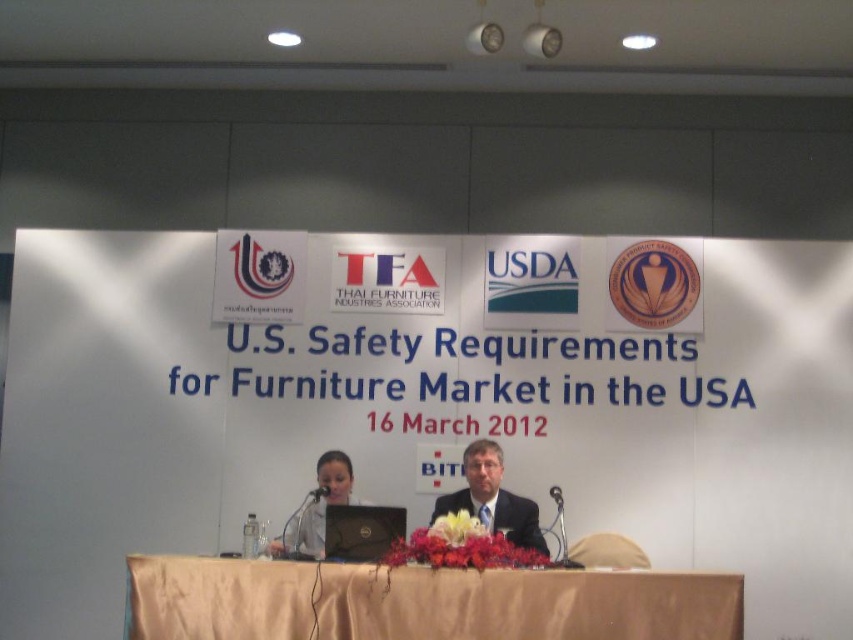
Who is shorter, gold satin table at center or dark suit at center?

Standing shorter between the two is gold satin table at center.

Which is behind, point (596, 572) or point (496, 452)?

The point (496, 452) is more distant.

Locate an element on the screen. This screenshot has width=853, height=640. gold satin table at center is located at coordinates (421, 602).

I want to click on gold satin table at center, so click(x=421, y=602).

From the picture: Who is positioned more to the right, dark suit at center or black matte laptop at center?

dark suit at center is more to the right.

Is dark suit at center below black matte laptop at center?

Yes.

Who is more forward, (544, 548) or (363, 545)?

Point (363, 545)

Identify the location of dark suit at center. (492, 499).

Is gold satin table at center above black matte laptop at center?

No.

In the scene shown: Does gold satin table at center have a lesser width compared to black matte laptop at center?

Incorrect, gold satin table at center's width is not less than black matte laptop at center's.

Find the location of a particular element. Image resolution: width=853 pixels, height=640 pixels. gold satin table at center is located at coordinates (421, 602).

Locate an element on the screen. The height and width of the screenshot is (640, 853). gold satin table at center is located at coordinates (421, 602).